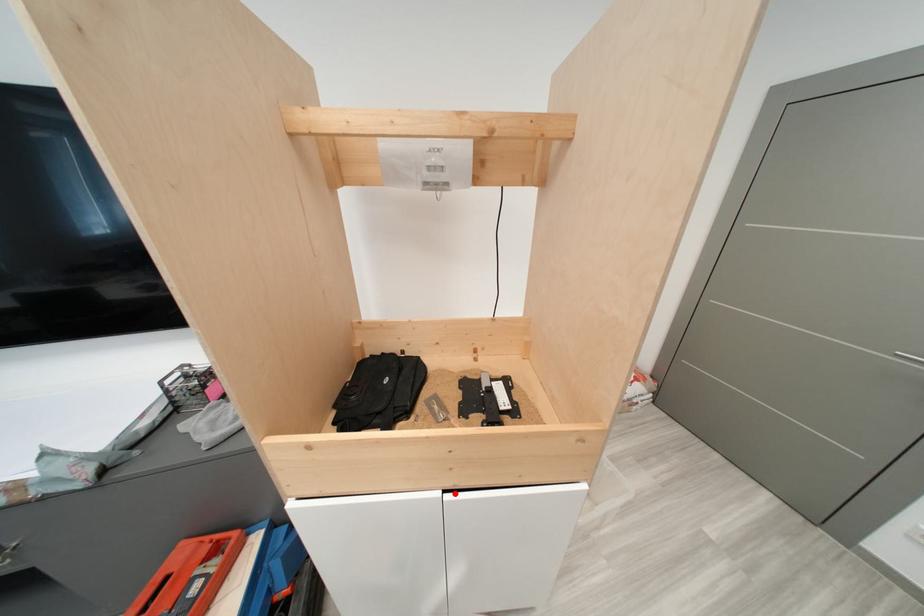
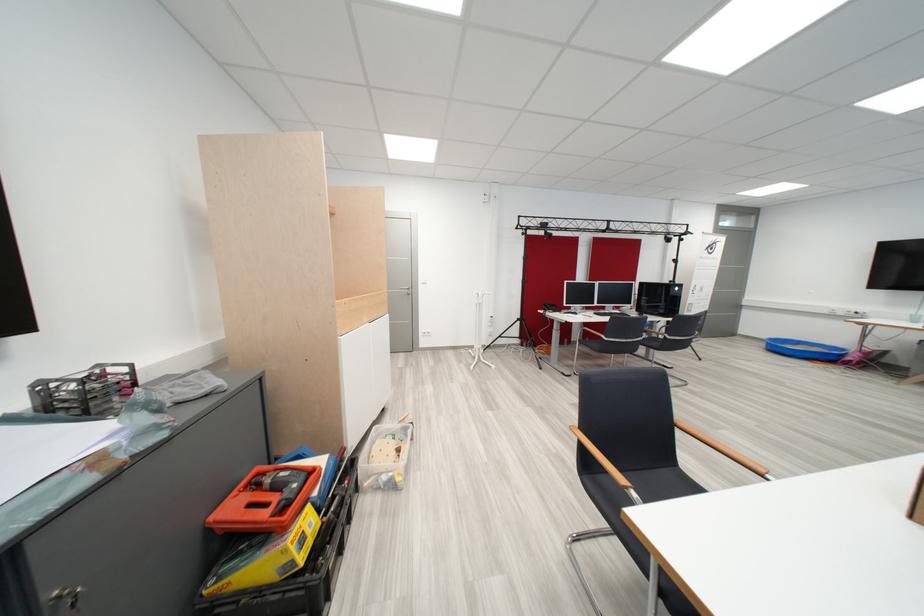
Question: I am providing you with two images of the same scene from different viewpoints. Given a red point in image1, look at the same physical point in image2. Is it:

Choices:
 (A) Closer to the viewpoint
 (B) Farther from the viewpoint

Answer: (A)